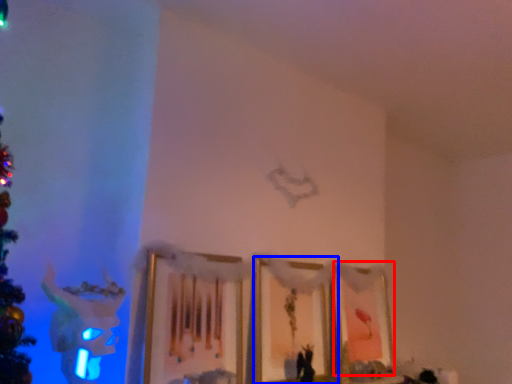
Question: Among these objects, which one is nearest to the camera, picture frame (highlighted by a red box) or picture frame (highlighted by a blue box)?

Choices:
 (A) picture frame
 (B) picture frame

Answer: (B)